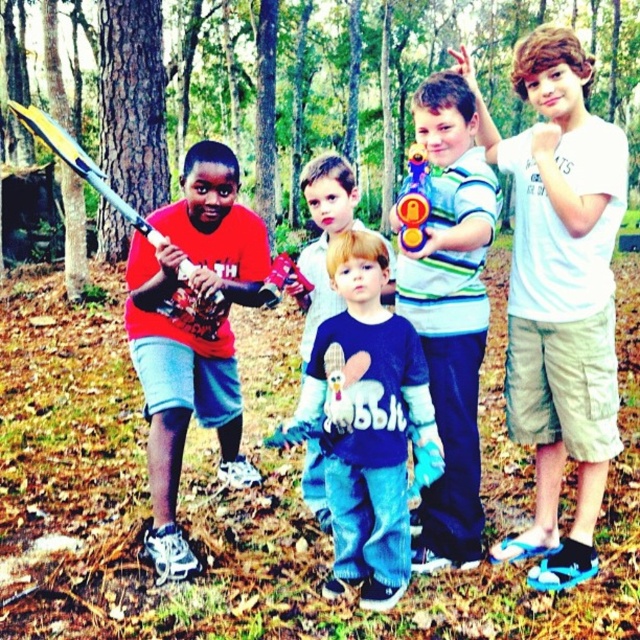
Between point (484, 317) and point (108, 200), which one is positioned behind?

Positioned behind is point (108, 200).

The image size is (640, 640). What do you see at coordinates (451, 314) in the screenshot?
I see `striped jersey toy gun at center` at bounding box center [451, 314].

Find the location of `striped jersey toy gun at center`. striped jersey toy gun at center is located at coordinates (451, 314).

Does yellow plastic baseball bat at left lie in front of translucent plastic toy gun at center?

No, yellow plastic baseball bat at left is further to the viewer.

Can you confirm if yellow plastic baseball bat at left is positioned above translucent plastic toy gun at center?

Yes, yellow plastic baseball bat at left is above translucent plastic toy gun at center.

Between point (138, 224) and point (417, 218), which one is positioned behind?

Point (138, 224)

You are a GUI agent. You are given a task and a screenshot of the screen. Output one action in this format:
    pyautogui.click(x=<x>, y=<y>)
    Task: Click on the yellow plastic baseball bat at left
    The width and height of the screenshot is (640, 640).
    Given the screenshot: What is the action you would take?
    pyautogui.click(x=81, y=164)

Consider the image. Who is more forward, (403, 570) or (422, 189)?

Positioned in front is point (422, 189).

The height and width of the screenshot is (640, 640). I want to click on blue fleece sweatshirt at center, so click(369, 424).

Who is more forward, (426,461) or (417,193)?

Positioned in front is point (417,193).

Locate an element on the screen. The width and height of the screenshot is (640, 640). blue fleece sweatshirt at center is located at coordinates (369, 424).